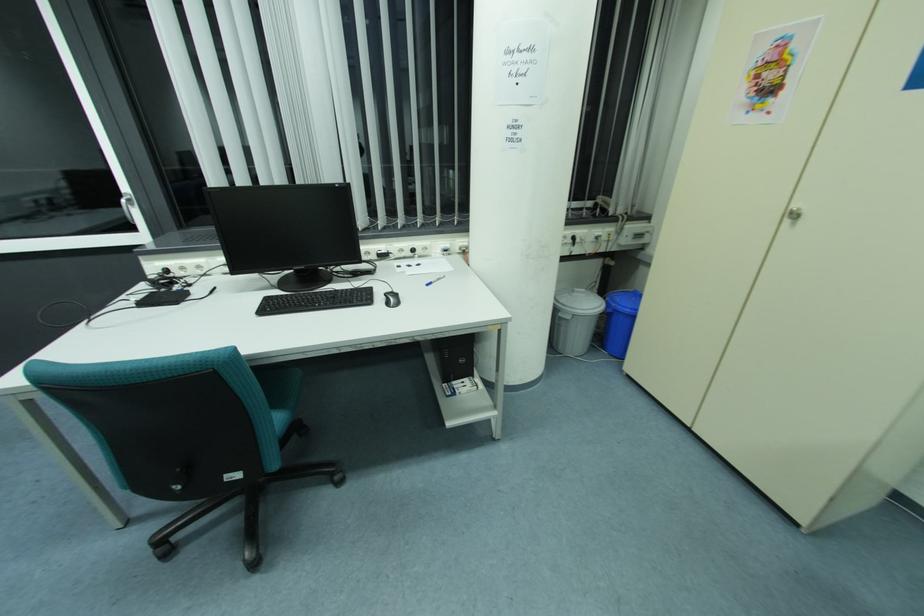
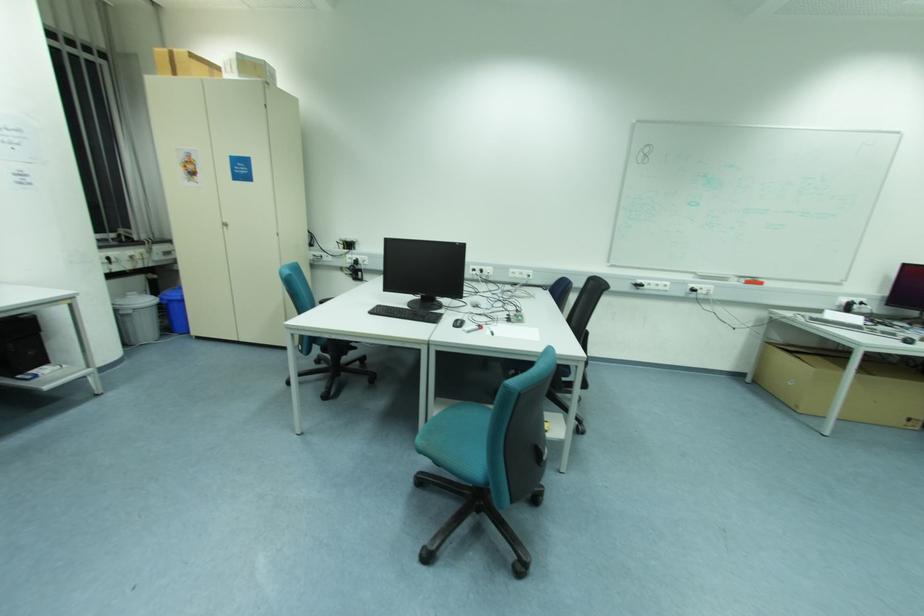
Locate, in the second image, the point that corresponds to (x=573, y=309) in the first image.

(130, 305)